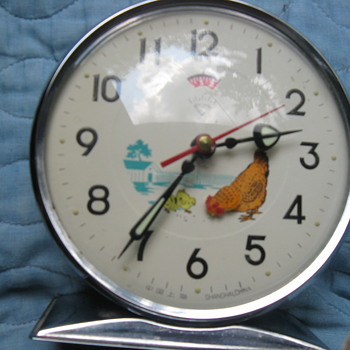
The height and width of the screenshot is (350, 350). I want to click on clock, so click(181, 131).